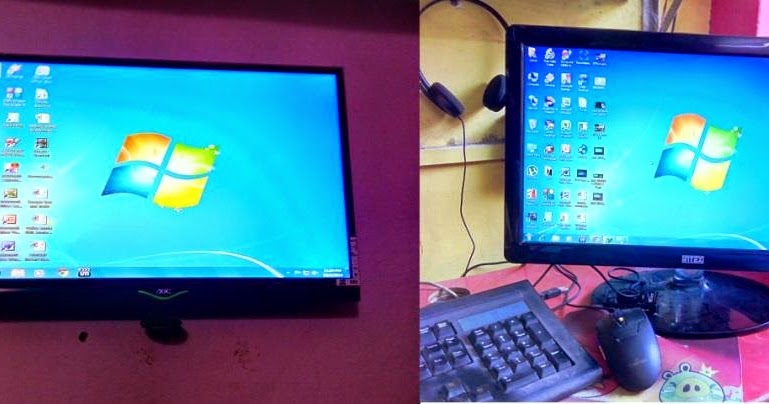
This screenshot has width=769, height=404. Find the location of `partial keyboard`. partial keyboard is located at coordinates (494, 344), (447, 372).